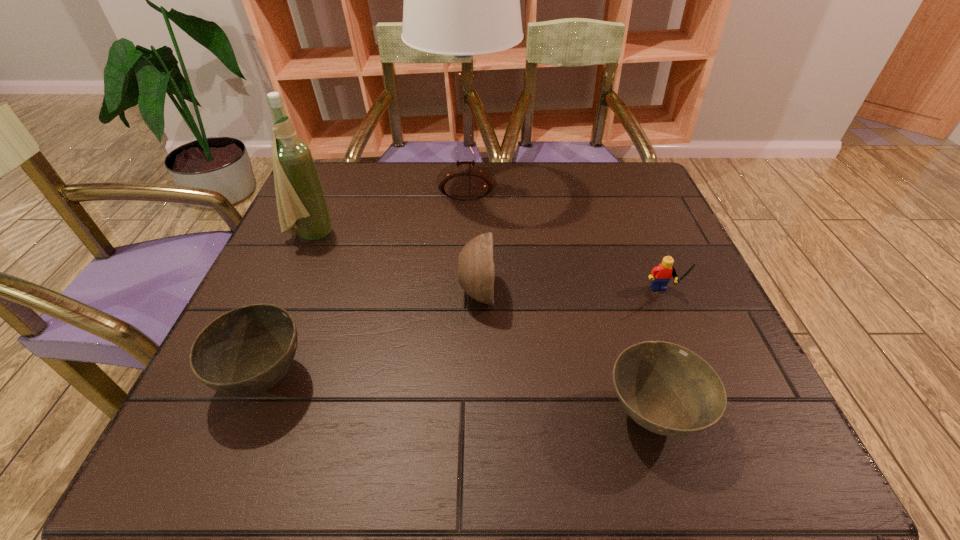
Locate an element on the screen. This screenshot has width=960, height=540. vacant area between the leftmost bowl and the wine bottle is located at coordinates (288, 307).

You are a GUI agent. You are given a task and a screenshot of the screen. Output one action in this format:
    pyautogui.click(x=<x>, y=<y>)
    Task: Click on the unoccupied position between the leftmost bowl and the second farthest object
    Image resolution: width=960 pixels, height=540 pixels.
    Given the screenshot: What is the action you would take?
    pyautogui.click(x=288, y=307)

Image resolution: width=960 pixels, height=540 pixels. I want to click on free space between the rightmost bowl and the farthest bowl, so click(564, 354).

Find the location of `free space between the tallest bowl and the leftmost bowl`. free space between the tallest bowl and the leftmost bowl is located at coordinates (372, 336).

This screenshot has height=540, width=960. Identify the location of unoccupied position between the Lego and the tallest object. (564, 241).

The height and width of the screenshot is (540, 960). I want to click on free area in between the leftmost bowl and the tallest object, so click(x=366, y=283).

Image resolution: width=960 pixels, height=540 pixels. I want to click on unoccupied position between the tallest bowl and the fifth nearest object, so click(x=394, y=265).

Locate which object ranks fifth in proximity to the Lego. Please provide its 2D coordinates. Your answer should be formatted as a tuple, i.e. [(x, y)], where the tuple contains the x and y coordinates of a point satisfying the conditions above.

[(300, 199)]

Identify the location of the fifth closest object to the Lego. This screenshot has height=540, width=960. (300, 199).

I want to click on bowl that stands as the second closest to the tallest bowl, so click(247, 350).